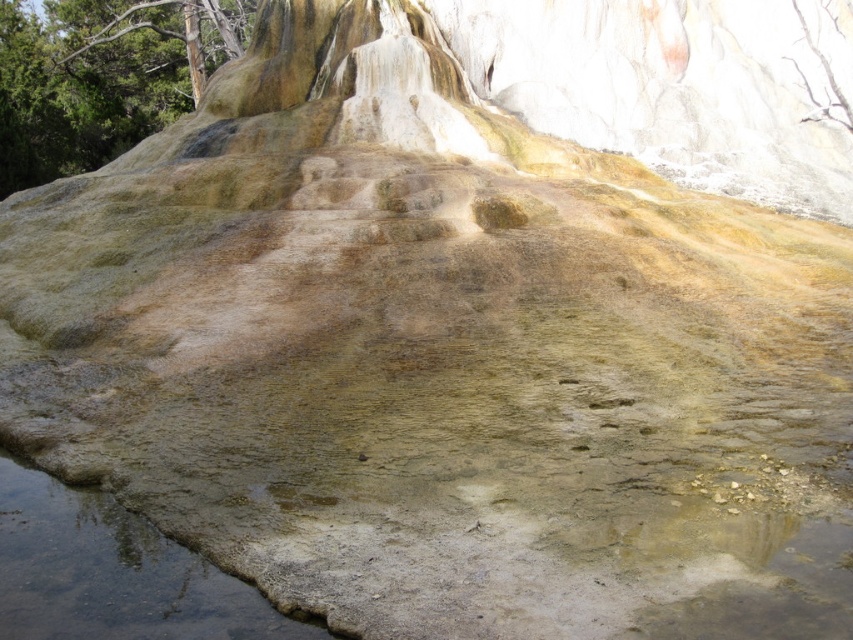
Question: Which of the following is the farthest from the observer?

Choices:
 (A) (96, 36)
 (B) (61, 499)

Answer: (A)

Question: Is smooth bark tree at upper left above clear water at bottom left?

Choices:
 (A) yes
 (B) no

Answer: (A)

Question: Is smooth bark tree at upper left thinner than clear water at bottom left?

Choices:
 (A) yes
 (B) no

Answer: (B)

Question: Is smooth bark tree at upper left bigger than clear water at bottom left?

Choices:
 (A) yes
 (B) no

Answer: (A)